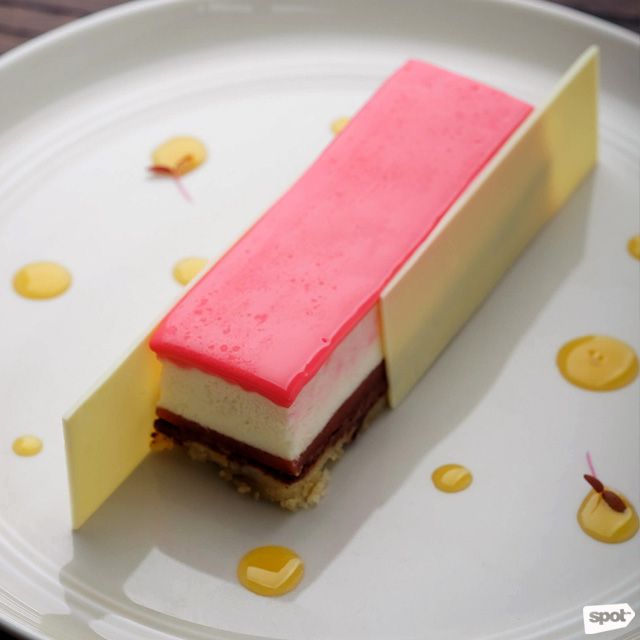
In order to click on edge of plate in this screenshot , I will do `click(20, 580)`.